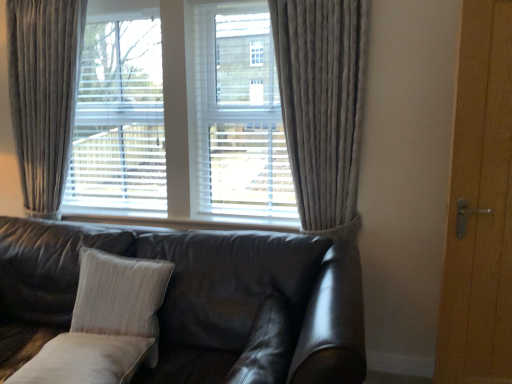
Question: Is suede-like beige pillow at lower center, the 1th pillow from the front, smaller than leather couch at center?

Choices:
 (A) no
 (B) yes

Answer: (B)

Question: Is suede-like beige pillow at lower center, marked as the 1th pillow in a right-to-left arrangement, oriented towards leather couch at center?

Choices:
 (A) no
 (B) yes

Answer: (B)

Question: Does suede-like beige pillow at lower center, the second pillow from the back, have a lesser height compared to leather couch at center?

Choices:
 (A) yes
 (B) no

Answer: (A)

Question: Is suede-like beige pillow at lower center, marked as the 1th pillow in a right-to-left arrangement, positioned behind leather couch at center?

Choices:
 (A) no
 (B) yes

Answer: (B)

Question: From the image's perspective, is suede-like beige pillow at lower center, the 1th pillow from the front, on top of leather couch at center?

Choices:
 (A) no
 (B) yes

Answer: (B)

Question: From a real-world perspective, is wooden door at right physically located above or below gray textured curtain at center, the first curtain in the right-to-left sequence?

Choices:
 (A) below
 (B) above

Answer: (A)

Question: Considering the relative positions of wooden door at right and gray textured curtain at center, which appears as the second curtain when viewed from the left, in the image provided, is wooden door at right to the left or to the right of gray textured curtain at center, which appears as the second curtain when viewed from the left,?

Choices:
 (A) right
 (B) left

Answer: (A)

Question: Considering the positions of wooden door at right and gray textured curtain at center, the first curtain in the right-to-left sequence, in the image, is wooden door at right taller or shorter than gray textured curtain at center, the first curtain in the right-to-left sequence,?

Choices:
 (A) short
 (B) tall

Answer: (B)

Question: Which is correct: wooden door at right is inside gray textured curtain at center, which appears as the second curtain when viewed from the left, or outside of it?

Choices:
 (A) outside
 (B) inside

Answer: (A)

Question: From a real-world perspective, is wooden door at right physically located above or below leather couch at center?

Choices:
 (A) above
 (B) below

Answer: (A)

Question: Considering the positions of point click(x=475, y=172) and point click(x=335, y=329), is point click(x=475, y=172) closer or farther from the camera than point click(x=335, y=329)?

Choices:
 (A) closer
 (B) farther

Answer: (B)

Question: Considering the relative positions of wooden door at right and leather couch at center in the image provided, is wooden door at right to the left or to the right of leather couch at center?

Choices:
 (A) left
 (B) right

Answer: (B)

Question: Is wooden door at right in front of or behind leather couch at center in the image?

Choices:
 (A) behind
 (B) front

Answer: (A)

Question: Choose the correct answer: Is leather couch at center inside velvet gray curtain at left, acting as the 2th curtain starting from the right, or outside it?

Choices:
 (A) inside
 (B) outside

Answer: (B)

Question: Is point (205, 322) positioned closer to the camera than point (27, 49)?

Choices:
 (A) farther
 (B) closer

Answer: (B)